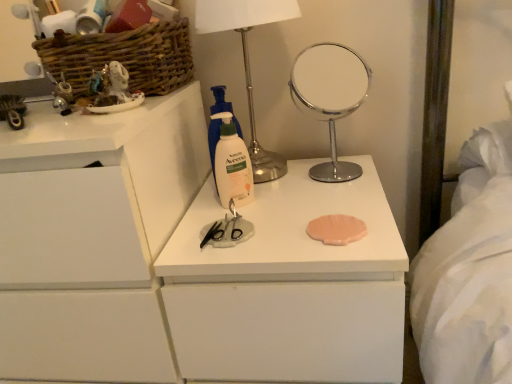
Find the location of a particular element. This screenshot has width=512, height=384. free location in front of metallic silver table lamp at upper center is located at coordinates (277, 207).